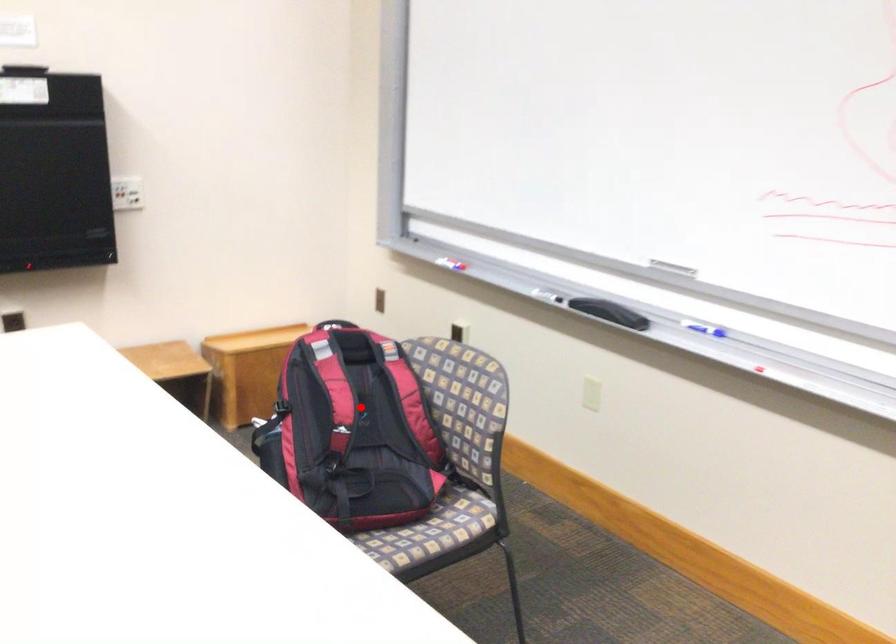
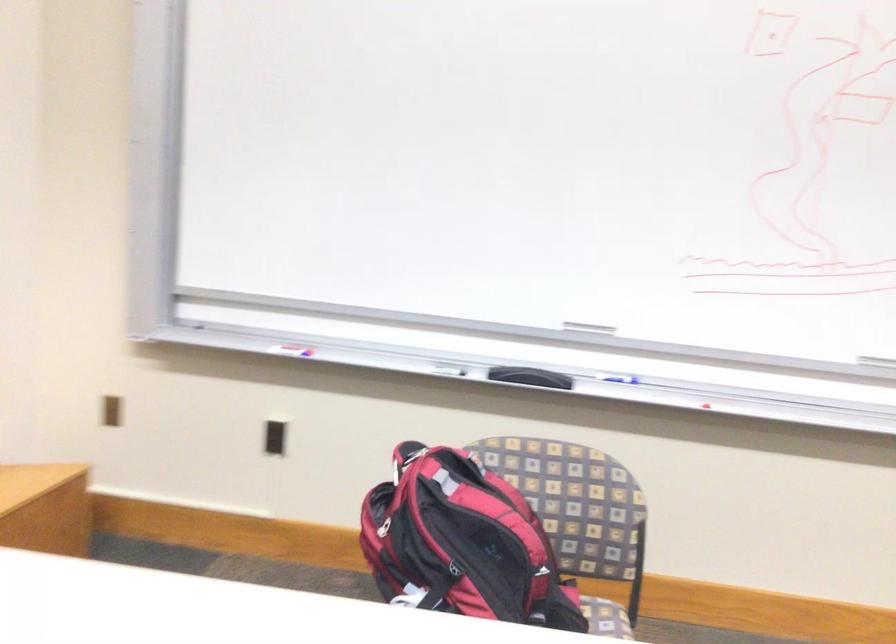
Question: I am providing you with two images of the same scene from different viewpoints. Image1 has a red point marked. In image2, the corresponding 3D location appears at what relative position? Reply with the corresponding letter.

Choices:
 (A) Closer
 (B) Farther

Answer: (A)